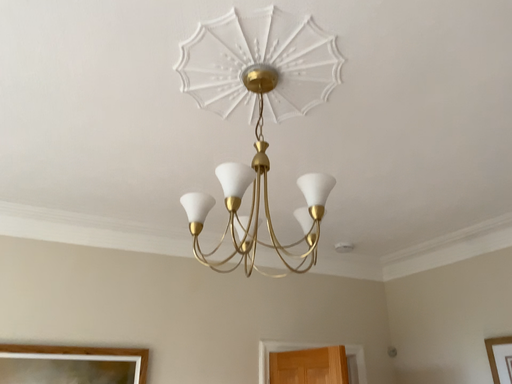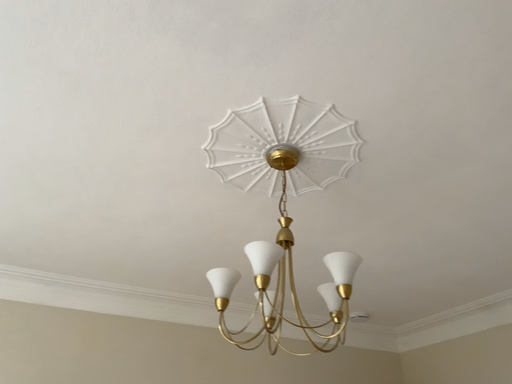
Question: Which way did the camera rotate in the video?

Choices:
 (A) rotated upward
 (B) rotated downward

Answer: (A)